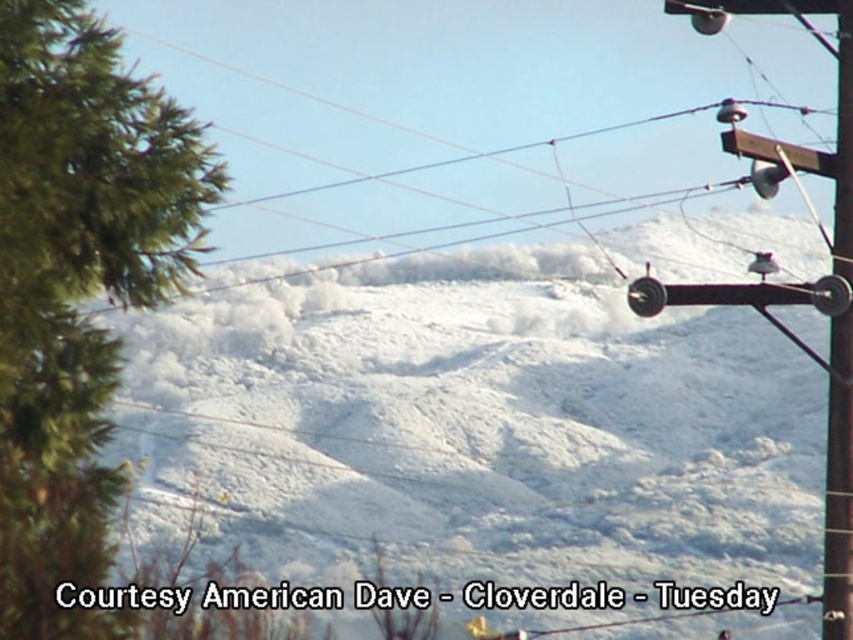
You are standing in the snowy landscape and want to take a photo of both the green textured tree at left and the brown wooden telegraph pole at upper right. Which object should you zoom in on to ensure both fit in the frame?

The green textured tree at left is larger in size than the brown wooden telegraph pole at upper right, so you should zoom out to ensure both fit in the frame.

You are standing at the camera position looking at the snowy landscape. There is a point marked at coordinates point (582, 100). Can you estimate how far this point is from your current position?

The point (582, 100) is 94.87 meters away from the camera, so the distance is approximately 94.87 meters.

You are a painter standing at the center of the snowy landscape. You want to paint the green textured tree at left and the brown wooden telegraph pole at upper right in your painting. If your canvas can only capture objects within 10 meters, will both objects fit on the canvas?

The distance between the green textured tree at left and the brown wooden telegraph pole at upper right is 8.54 meters, which is within the 10 meters range. Therefore, both objects will fit on the canvas.